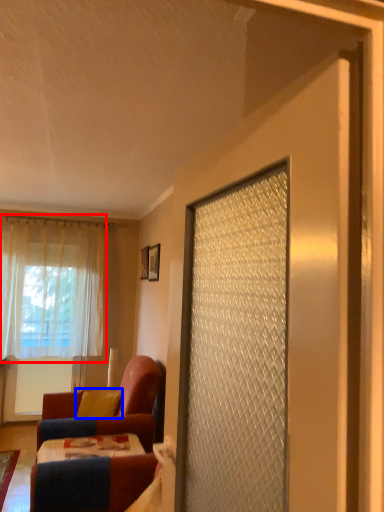
Question: Which object appears closest to the camera in this image, curtain (highlighted by a red box) or pillow (highlighted by a blue box)?

Choices:
 (A) curtain
 (B) pillow

Answer: (B)